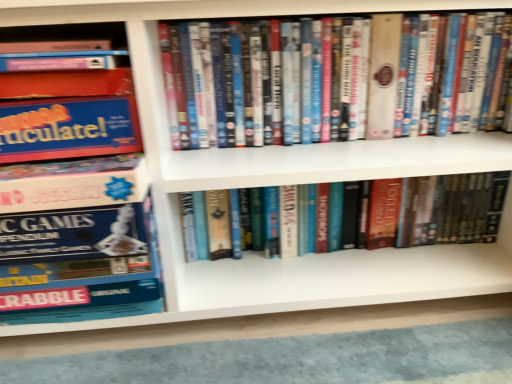
Question: Does matte plastic dvds at center, placed as the 2th book when sorted from left to right, have a smaller size compared to blue cardboard game box at left, the first book from the left?

Choices:
 (A) no
 (B) yes

Answer: (B)

Question: Is matte plastic dvds at center, placed as the 2th book when sorted from left to right, in contact with blue cardboard game box at left, which is counted as the third book, starting from the right?

Choices:
 (A) yes
 (B) no

Answer: (B)

Question: Does matte plastic dvds at center, marked as the second book in a right-to-left arrangement, appear on the left side of blue cardboard game box at left, the first book from the left?

Choices:
 (A) yes
 (B) no

Answer: (B)

Question: From the image's perspective, is matte plastic dvds at center, placed as the 2th book when sorted from left to right, below blue cardboard game box at left, the first book from the left?

Choices:
 (A) no
 (B) yes

Answer: (A)

Question: Is matte plastic dvds at center, marked as the second book in a right-to-left arrangement, to the right of blue cardboard game box at left, which is counted as the third book, starting from the right, from the viewer's perspective?

Choices:
 (A) yes
 (B) no

Answer: (A)

Question: Looking at their shapes, would you say blue cardboard game box at left, the first book from the left, is wider or thinner than hardcover book at center, the third book viewed from the left?

Choices:
 (A) wide
 (B) thin

Answer: (A)

Question: In terms of size, does blue cardboard game box at left, the first book from the left, appear bigger or smaller than hardcover book at center, the third book viewed from the left?

Choices:
 (A) small
 (B) big

Answer: (B)

Question: Based on their positions, is blue cardboard game box at left, which is counted as the third book, starting from the right, located to the left or right of hardcover book at center, the third book viewed from the left?

Choices:
 (A) left
 (B) right

Answer: (A)

Question: From a real-world perspective, is blue cardboard game box at left, which is counted as the third book, starting from the right, above or below hardcover book at center, the third book viewed from the left?

Choices:
 (A) above
 (B) below

Answer: (A)

Question: From the image's perspective, relative to matte plastic dvds at center, marked as the second book in a right-to-left arrangement, is blue cardboard game box at left, which is counted as the third book, starting from the right, above or below?

Choices:
 (A) above
 (B) below

Answer: (B)

Question: Which is correct: blue cardboard game box at left, which is counted as the third book, starting from the right, is inside matte plastic dvds at center, marked as the second book in a right-to-left arrangement, or outside of it?

Choices:
 (A) outside
 (B) inside

Answer: (A)

Question: Considering the positions of blue cardboard game box at left, which is counted as the third book, starting from the right, and matte plastic dvds at center, marked as the second book in a right-to-left arrangement, in the image, is blue cardboard game box at left, which is counted as the third book, starting from the right, bigger or smaller than matte plastic dvds at center, marked as the second book in a right-to-left arrangement,?

Choices:
 (A) small
 (B) big

Answer: (B)

Question: Visually, is blue cardboard game box at left, the first book from the left, positioned to the left or to the right of matte plastic dvds at center, placed as the 2th book when sorted from left to right?

Choices:
 (A) left
 (B) right

Answer: (A)

Question: From the image's perspective, is matte plastic dvds at center, placed as the 2th book when sorted from left to right, located above or below hardcover book at center, which is the first book in right-to-left order?

Choices:
 (A) below
 (B) above

Answer: (B)

Question: Is matte plastic dvds at center, placed as the 2th book when sorted from left to right, spatially inside hardcover book at center, the third book viewed from the left, or outside of it?

Choices:
 (A) outside
 (B) inside

Answer: (A)